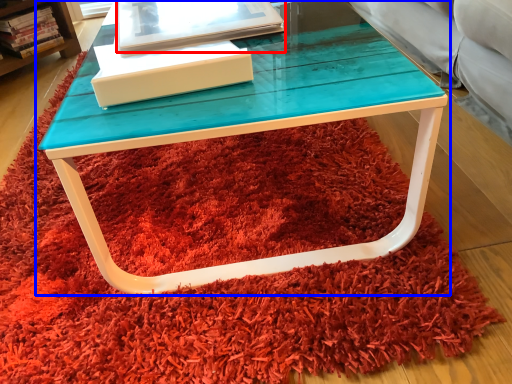
Question: Which object is closer to the camera taking this photo, book (highlighted by a red box) or table (highlighted by a blue box)?

Choices:
 (A) book
 (B) table

Answer: (B)